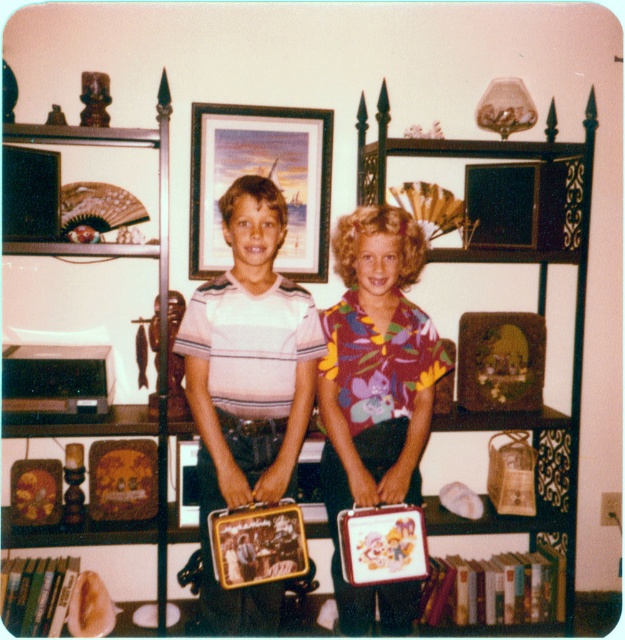
Between metallic lunchbox at center and wooden picture frame at center, which one appears on the right side from the viewer's perspective?

metallic lunchbox at center

Which is above, metallic lunchbox at center or wooden picture frame at center?

Positioned higher is wooden picture frame at center.

Does point (336, 547) come closer to viewer compared to point (296, 147)?

Yes, point (336, 547) is in front of point (296, 147).

I want to click on metallic lunchbox at center, so click(x=251, y=385).

Where is `wooden picture frame at center`? wooden picture frame at center is located at coordinates (262, 177).

Find the location of a particular element. Image resolution: width=625 pixels, height=640 pixels. wooden picture frame at center is located at coordinates (262, 177).

Locate an element on the screen. wooden picture frame at center is located at coordinates (262, 177).

Does metallic lunchbox at center have a greater height compared to wooden bookshelf at center?

No.

Who is shorter, metallic lunchbox at center or wooden bookshelf at center?

metallic lunchbox at center

Identify the location of metallic lunchbox at center. (251, 385).

Where is `metallic lunchbox at center`? metallic lunchbox at center is located at coordinates (251, 385).